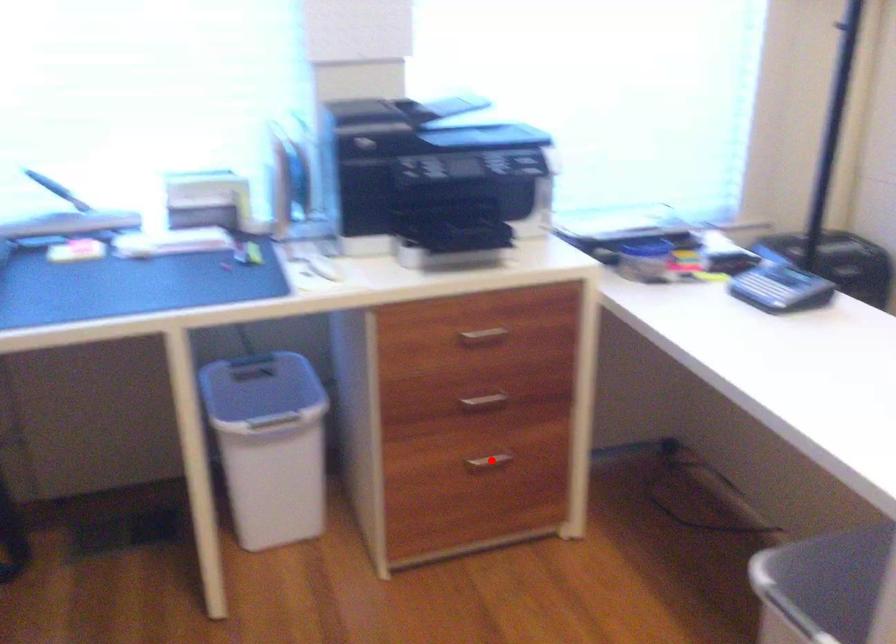
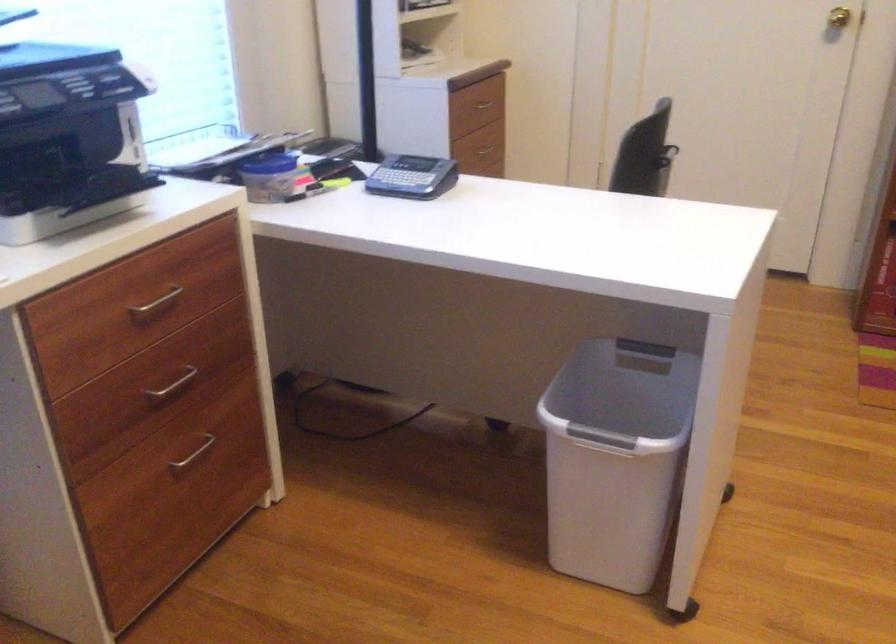
The point at the highlighted location is marked in the first image. Where is the corresponding point in the second image?

(193, 453)